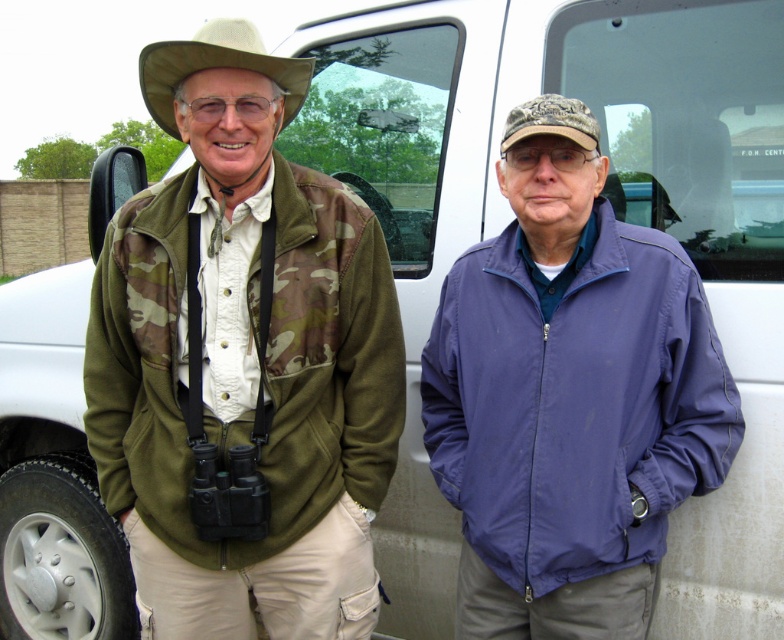
Question: Estimate the real-world distances between objects in this image. Which object is closer to the purple nylon jacket at center?

Choices:
 (A) camo fabric cap at center
 (B) camo fabric jacket at left

Answer: (A)

Question: Which of these objects is positioned closest to the tan/cotton cowboy hat at upper left?

Choices:
 (A) purple nylon jacket at center
 (B) camo fabric jacket at left

Answer: (B)

Question: Is camo fabric jacket at left positioned at the back of tan/cotton cowboy hat at upper left?

Choices:
 (A) yes
 (B) no

Answer: (B)

Question: Observing the image, what is the correct spatial positioning of purple nylon jacket at center in reference to camo fabric cap at center?

Choices:
 (A) left
 (B) right

Answer: (B)

Question: Is purple nylon jacket at center bigger than tan/cotton cowboy hat at upper left?

Choices:
 (A) no
 (B) yes

Answer: (B)

Question: Which point is closer to the camera?

Choices:
 (A) purple nylon jacket at center
 (B) camo fabric cap at center

Answer: (B)